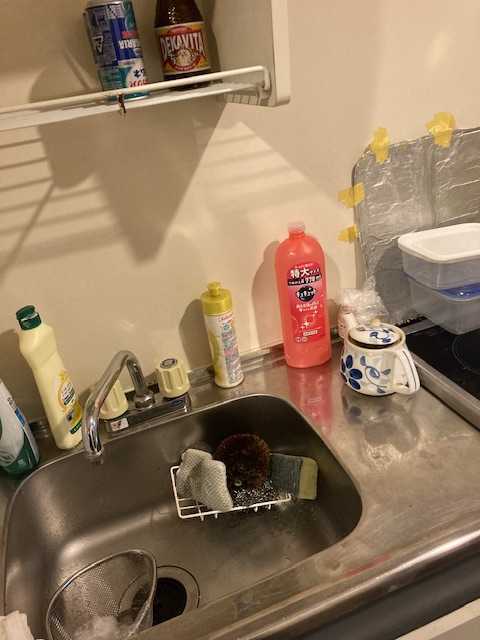
Identify the location of faucet. This screenshot has width=480, height=640. (91, 457).